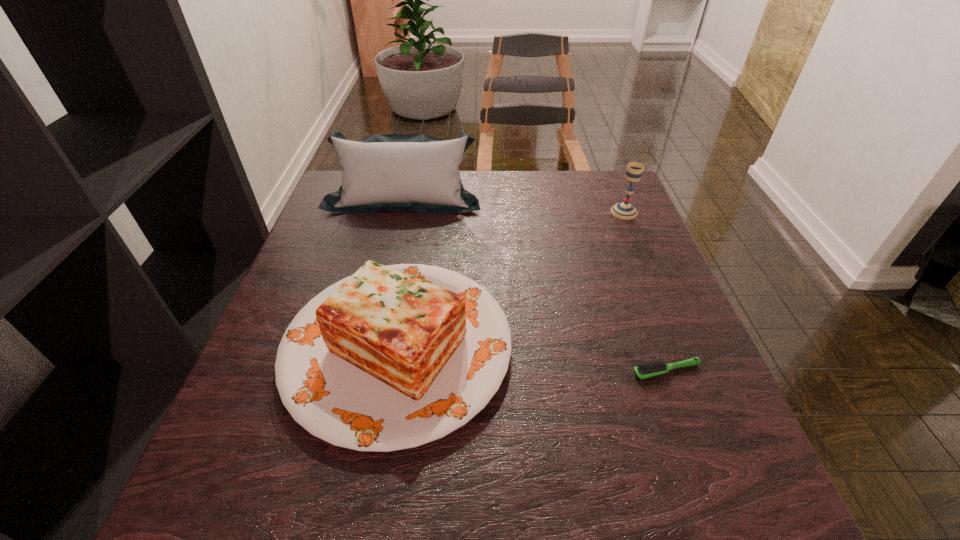
The image size is (960, 540). What are the coordinates of `vacant region at the far right corner of the desktop` in the screenshot? It's located at (590, 202).

In order to click on vacant area between the cushion and the chalice in this screenshot , I will do `click(514, 205)`.

Identify the location of unoccupied area between the chalice and the cushion. (514, 205).

Image resolution: width=960 pixels, height=540 pixels. Identify the location of free spot between the shortest object and the lasagna. (532, 359).

At what (x,y) coordinates should I click in order to perform the action: click on free space between the tallest object and the chalice. Please return your answer as a coordinate pair (x, y). The height and width of the screenshot is (540, 960). Looking at the image, I should click on (514, 205).

I want to click on vacant area that lies between the chalice and the tallest object, so click(x=514, y=205).

The image size is (960, 540). I want to click on unoccupied area between the lasagna and the chalice, so click(511, 280).

The image size is (960, 540). Find the location of `free space between the chalice and the cushion`. free space between the chalice and the cushion is located at coordinates (514, 205).

Identify the location of free point between the lasagna and the chalice. The height and width of the screenshot is (540, 960). (511, 280).

Where is `vacant area that lies between the chalice and the hairbrush`? The image size is (960, 540). vacant area that lies between the chalice and the hairbrush is located at coordinates (645, 291).